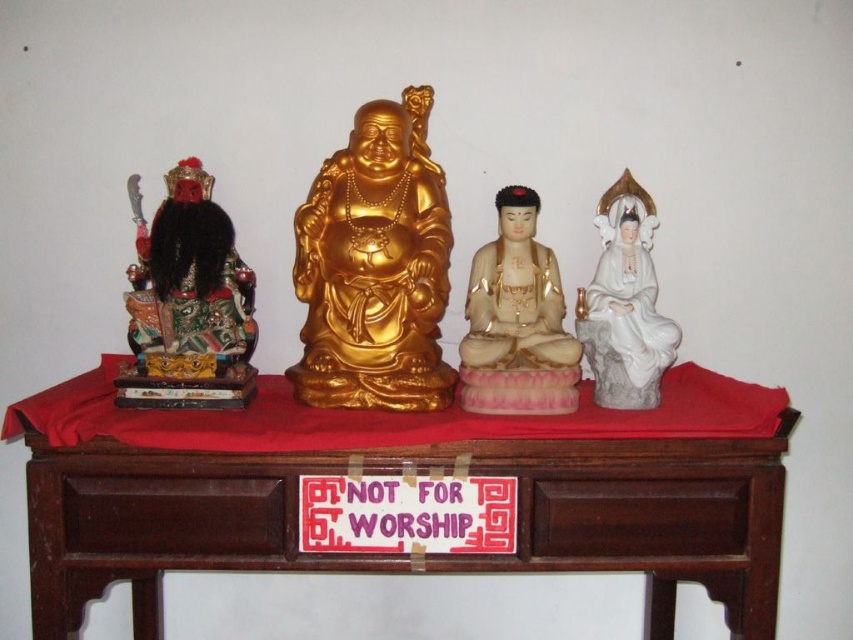
You are an art curator arranging an exhibition. You have two statues, the gold glossy statue at center and the white porcelain statue at right. Which one is positioned higher up in the image?

The gold glossy statue at center is positioned higher up in the image than the white porcelain statue at right.

You are an interior designer arranging items on a shelf. You have a multicolored painted wood statue at left and a white porcelain statue at center. Which statue requires more horizontal space to display properly?

The multicolored painted wood statue at left requires more horizontal space because its width is larger than the white porcelain statue at center.